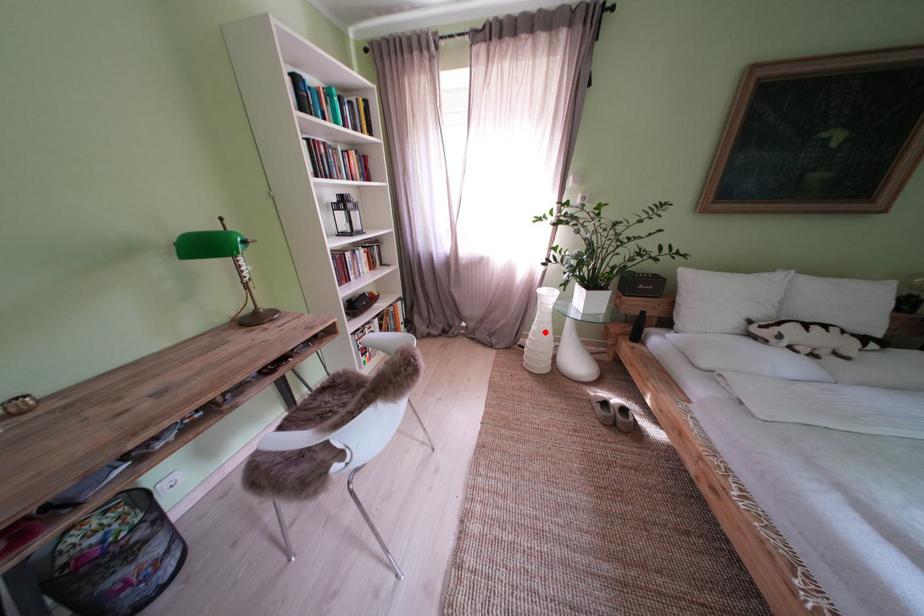
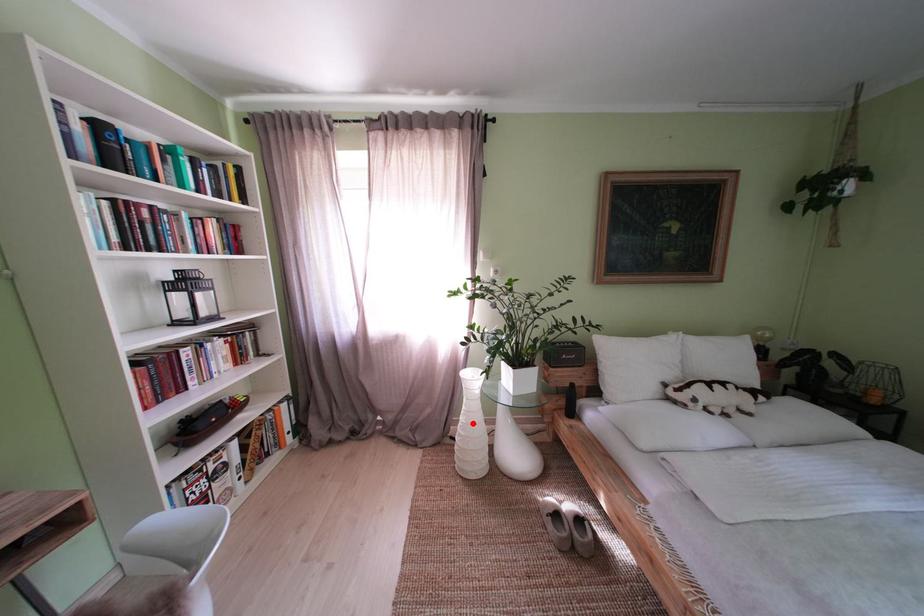
I am providing you with two images of the same scene from different viewpoints. A red point is marked on the first image and another point is marked on the second image. Does the point marked in image1 correspond to the same location as the one in image2?

Yes